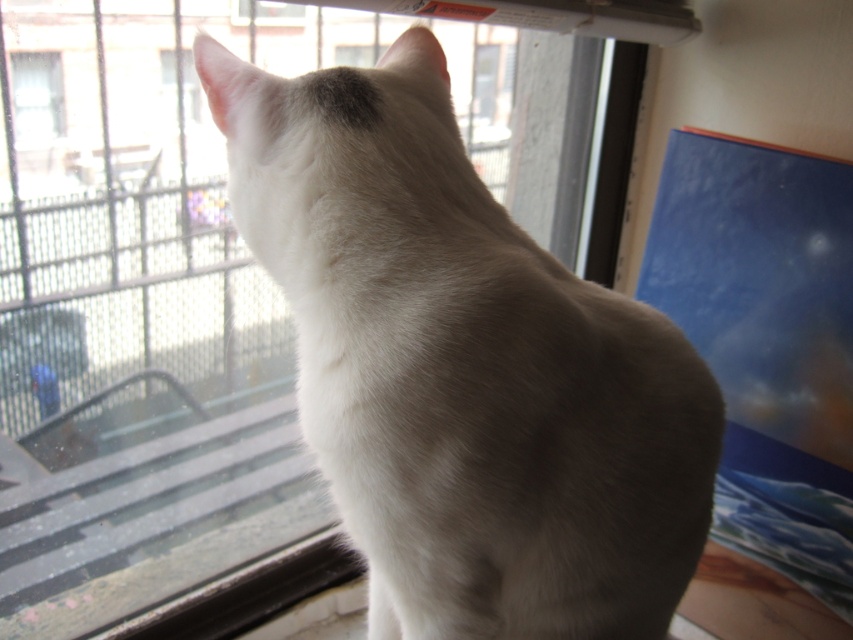
Can you confirm if white fur cat at center is positioned to the right of transparent glass window at upper left?

Yes, white fur cat at center is to the right of transparent glass window at upper left.

Looking at this image, which of these two, white fur cat at center or transparent glass window at upper left, stands taller?

white fur cat at center

The image size is (853, 640). Describe the element at coordinates (463, 368) in the screenshot. I see `white fur cat at center` at that location.

Find the location of a particular element. Image resolution: width=853 pixels, height=640 pixels. white fur cat at center is located at coordinates (463, 368).